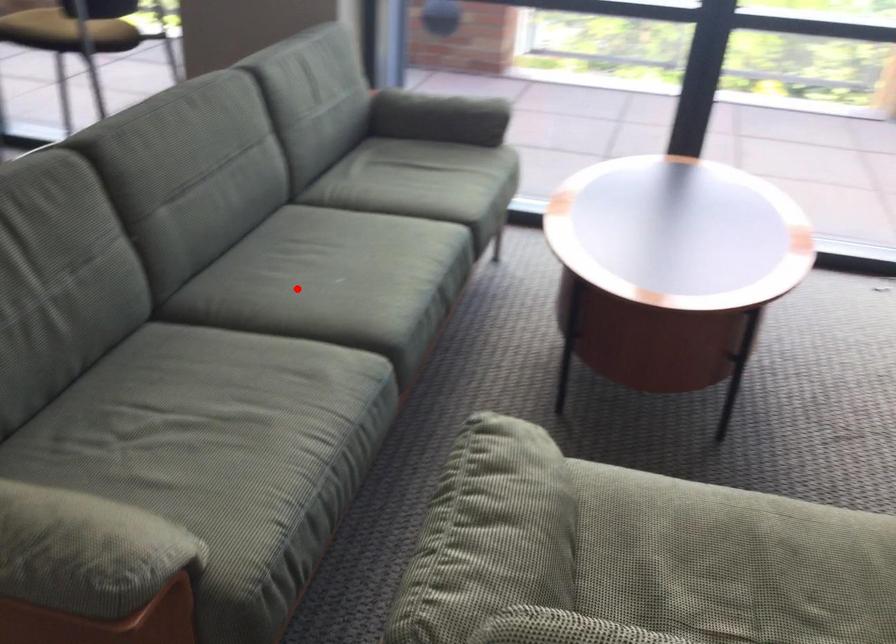
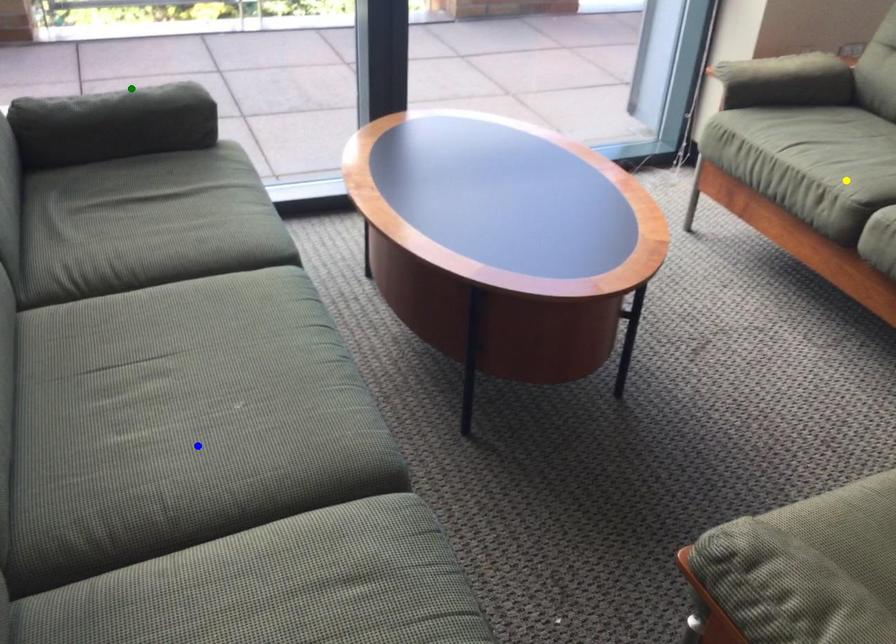
Question: I am providing you with two images of the same scene from different viewpoints. A red point is marked on the first image. You are given multiple points on the second image. Can you choose the point in image 2 that corresponds to the point in image 1?

Choices:
 (A) yellow point
 (B) green point
 (C) blue point

Answer: (C)